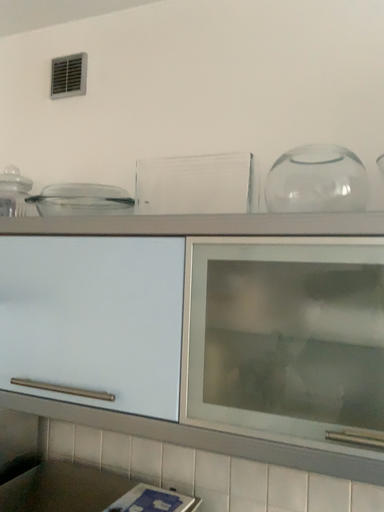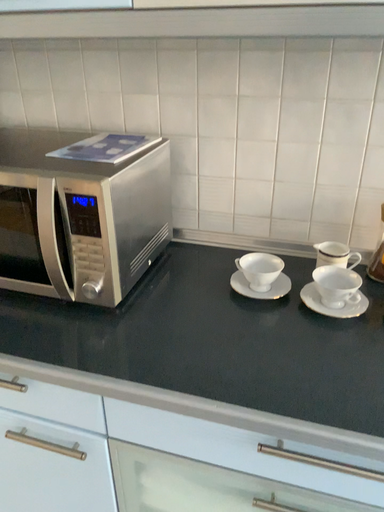
Question: Which way did the camera rotate in the video?

Choices:
 (A) rotated downward
 (B) rotated upward

Answer: (A)